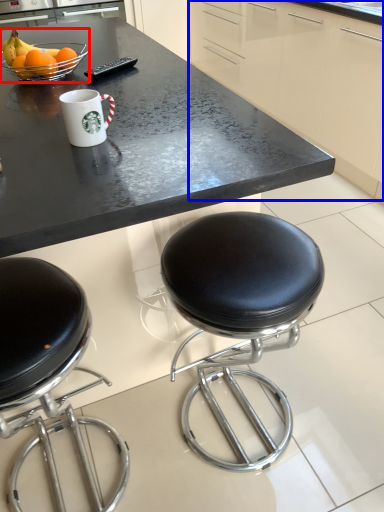
Question: Which of the following is the closest to the observer, bowl (highlighted by a red box) or cabinetry (highlighted by a blue box)?

Choices:
 (A) bowl
 (B) cabinetry

Answer: (A)